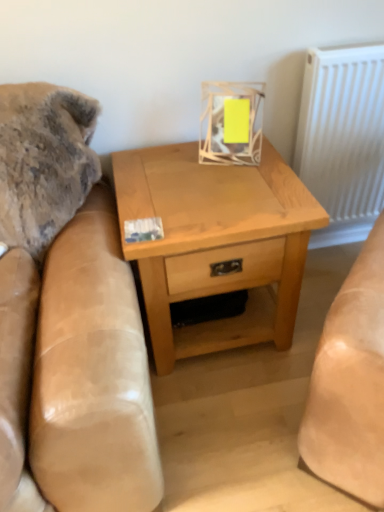
Question: Is point coord(195,202) positioned closer to the camera than point coord(372,89)?

Choices:
 (A) farther
 (B) closer

Answer: (B)

Question: Based on their positions, is light wood/texture nightstand at center located to the left or right of white textured radiator at upper right?

Choices:
 (A) left
 (B) right

Answer: (A)

Question: From the image's perspective, relative to white textured radiator at upper right, is light wood/texture nightstand at center above or below?

Choices:
 (A) below
 (B) above

Answer: (A)

Question: Would you say white textured radiator at upper right is inside or outside light wood/texture nightstand at center?

Choices:
 (A) outside
 (B) inside

Answer: (A)

Question: Is point (352, 144) closer or farther from the camera than point (276, 266)?

Choices:
 (A) closer
 (B) farther

Answer: (B)

Question: Considering the positions of white textured radiator at upper right and light wood/texture nightstand at center in the image, is white textured radiator at upper right bigger or smaller than light wood/texture nightstand at center?

Choices:
 (A) big
 (B) small

Answer: (B)

Question: In the image, is white textured radiator at upper right positioned in front of or behind light wood/texture nightstand at center?

Choices:
 (A) behind
 (B) front

Answer: (A)